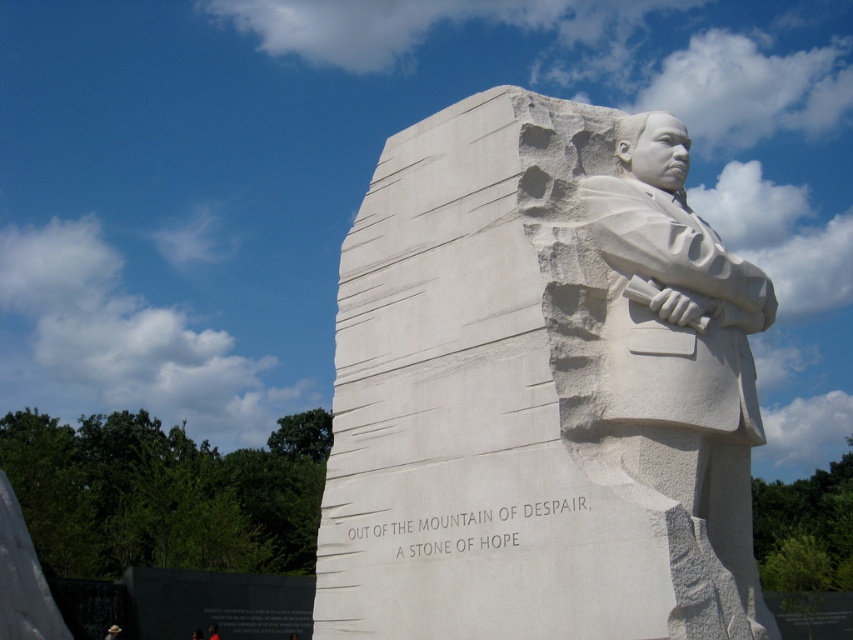
You are visiting the Martin Luther King Jr. Memorial and want to take a photo that includes both the white stone statue at center and the white stone statue at right. Based on their positions, which statue should you focus on first to ensure both are in frame?

The white stone statue at center is below the white stone statue at right, so you should focus on the white stone statue at right first to ensure both are in frame.

You are visiting the Martin Luther King Jr. Memorial and want to take a photo of both the white stone statue at center and the white stone statue at right. Which statue should you stand closer to in order to capture both in a single frame?

You should stand closer to the white stone statue at right because the white stone statue at center is taller than the white stone statue at right, so positioning yourself closer to the shorter statue will help include both in the frame without one being cut off.

You are standing at the Martin Luther King Jr. Memorial and want to take a photo of the white stone statue at center. If you are currently at the point with coordinates point at (540, 388), are you already positioned directly in front of the statue?

Yes, you are already positioned directly in front of the white stone statue at center because the point at (540, 388) corresponds to the statue.